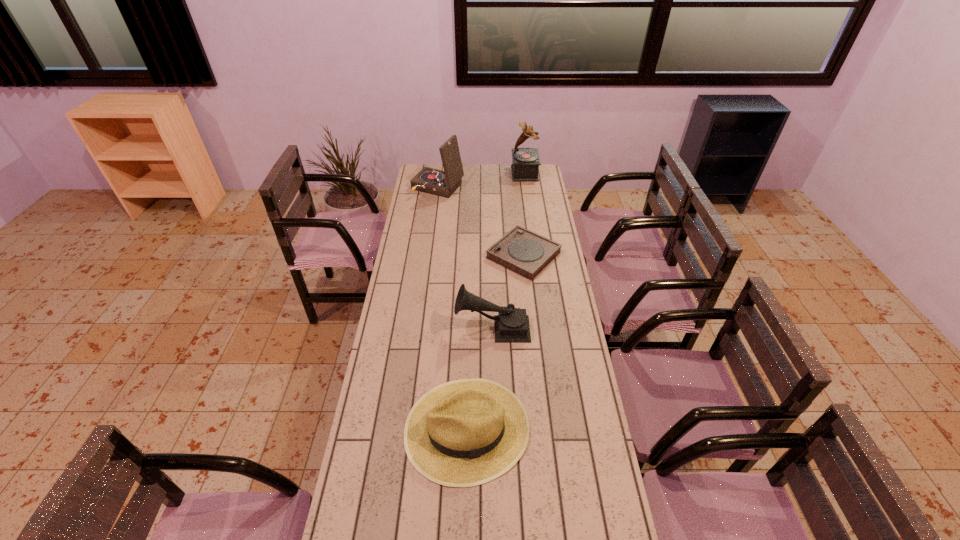
Identify the location of vacant area situated 0.310m on the back of the shortest object. (517, 198).

Where is `phonograph record positioned at the left edge`? phonograph record positioned at the left edge is located at coordinates (442, 183).

Identify the location of sunhat that is at the left edge. Image resolution: width=960 pixels, height=540 pixels. (462, 433).

At what (x,y) coordinates should I click in order to perform the action: click on object that is at the far left corner. Please return your answer as a coordinate pair (x, y). The height and width of the screenshot is (540, 960). Looking at the image, I should click on (442, 183).

In order to click on object present at the far right corner in this screenshot , I will do `click(525, 164)`.

Locate an element on the screen. The width and height of the screenshot is (960, 540). free spot at the far edge of the desktop is located at coordinates (474, 167).

In the image, there is a desktop. Where is `free region at the left edge`? This screenshot has height=540, width=960. free region at the left edge is located at coordinates (407, 381).

In the image, there is a desktop. Where is `vacant space at the right edge`? vacant space at the right edge is located at coordinates (539, 274).

You are a GUI agent. You are given a task and a screenshot of the screen. Output one action in this format:
    pyautogui.click(x=<x>, y=<y>)
    Task: Click on the free space at the far right corner of the desktop
    This screenshot has width=960, height=540.
    Given the screenshot: What is the action you would take?
    pyautogui.click(x=534, y=185)

This screenshot has height=540, width=960. Find the location of `object that ranks as the closest to the nearest object`. object that ranks as the closest to the nearest object is located at coordinates (511, 324).